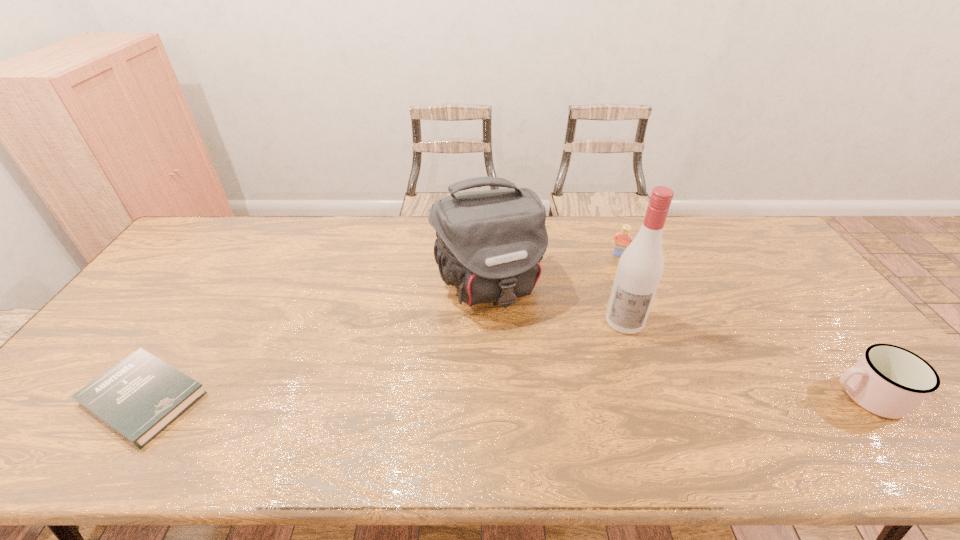
This screenshot has height=540, width=960. Find the location of `free space located on the side of the rightmost object with the handle`. free space located on the side of the rightmost object with the handle is located at coordinates [804, 396].

I want to click on vacant area situated 0.080m on the open flap of the shoulder bag, so click(515, 341).

Where is `free region located on the open flap of the shoulder bag`? The width and height of the screenshot is (960, 540). free region located on the open flap of the shoulder bag is located at coordinates (526, 367).

Identify the location of free space located 0.200m on the open flap of the shoulder bag. The image size is (960, 540). (530, 376).

At what (x,y) coordinates should I click in order to perform the action: click on vacant space located on the label of the alcohol. Please return your answer as a coordinate pair (x, y). The image size is (960, 540). Looking at the image, I should click on (614, 373).

This screenshot has height=540, width=960. Identify the location of vacant space situated 0.130m on the label of the alcohol. (x=615, y=370).

This screenshot has width=960, height=540. I want to click on free space located 0.270m on the label of the alcohol, so click(606, 415).

The height and width of the screenshot is (540, 960). I want to click on vacant space located 0.220m on the front-facing side of the Lego, so click(602, 300).

Where is `vacant space located on the front-facing side of the Lego`? vacant space located on the front-facing side of the Lego is located at coordinates (600, 307).

Identify the location of vacant space located 0.130m on the front-facing side of the Lego. Image resolution: width=960 pixels, height=540 pixels. (609, 282).